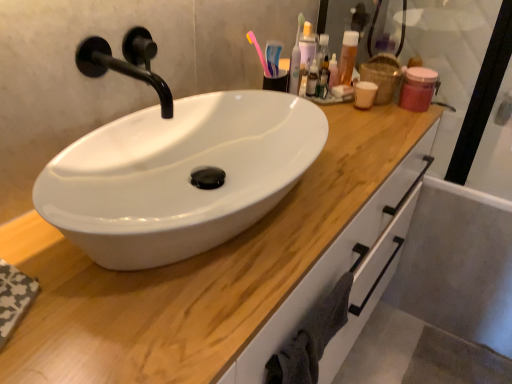
Locate an element on the screen. This screenshot has width=512, height=384. vacant region above wooden at center (from a real-world perspective) is located at coordinates (315, 168).